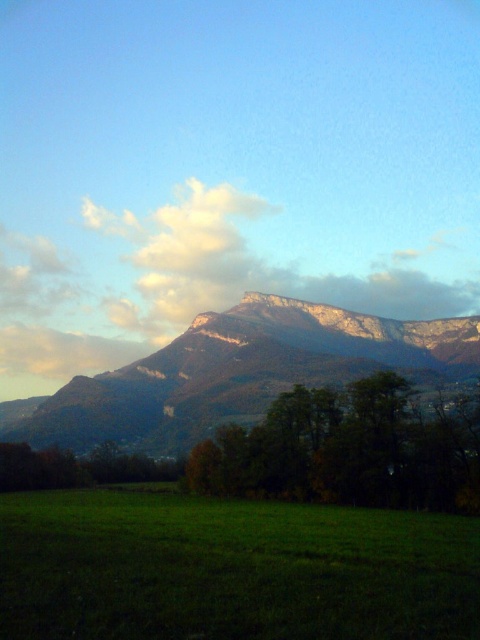
Does rugged stone mountain range at center have a smaller size compared to white fluffy cloud at upper center?

No.

Between point (312, 340) and point (376, 268), which one is positioned behind?

Point (376, 268)

You are a GUI agent. You are given a task and a screenshot of the screen. Output one action in this format:
    pyautogui.click(x=<x>, y=<y>)
    Task: Click on the rugged stone mountain range at center
    
    Given the screenshot: What is the action you would take?
    pyautogui.click(x=241, y=372)

The height and width of the screenshot is (640, 480). Find the location of `rugged stone mountain range at center`. rugged stone mountain range at center is located at coordinates (241, 372).

Is green grass at lower left thinner than green matte tree at center?

In fact, green grass at lower left might be wider than green matte tree at center.

Between point (295, 513) and point (308, 388), which one is positioned behind?

The point (308, 388) is behind.

Does point (337, 552) come behind point (287, 440)?

No, (337, 552) is closer to viewer.

Identify the location of green grass at lower left. (230, 570).